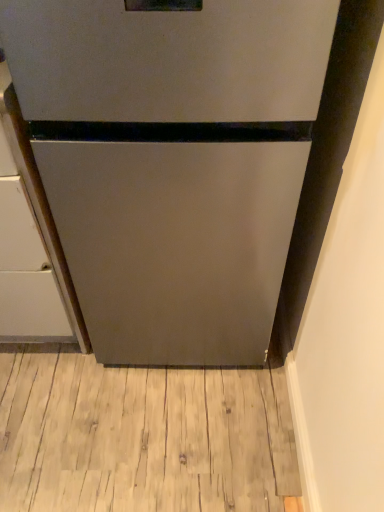
Locate an element on the screen. free space above light brown wood flooring at lower center (from a real-world perspective) is located at coordinates (128, 414).